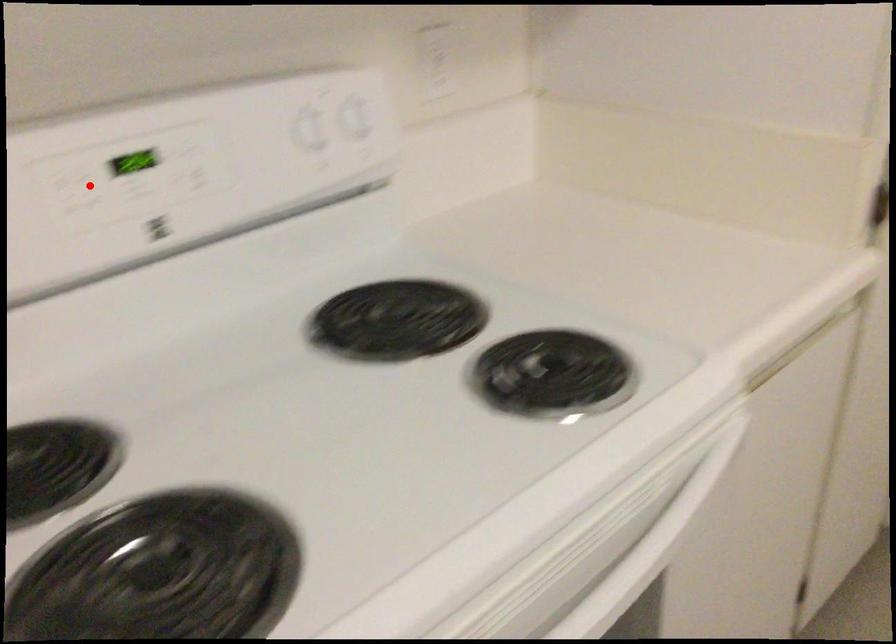
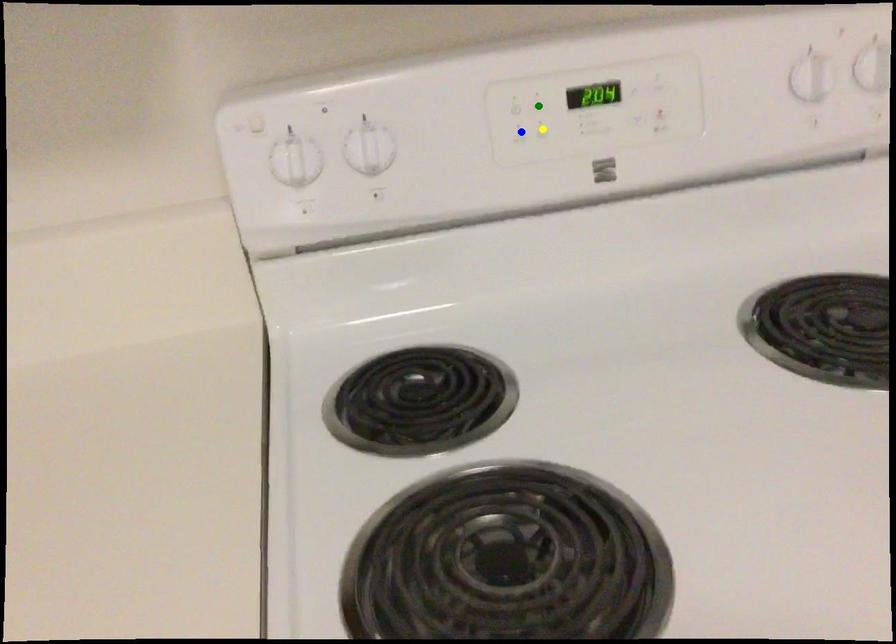
Question: I am providing you with two images of the same scene from different viewpoints. A red point is marked on the first image. You are given multiple points on the second image. Which spot in image 2 lines up with the point in image 1?

Choices:
 (A) yellow point
 (B) green point
 (C) blue point

Answer: (B)